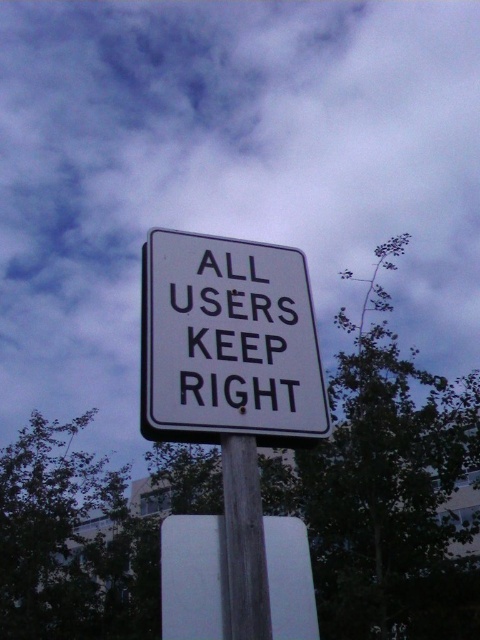
Question: Is white matte sign at center positioned in front of wooden post at center?

Choices:
 (A) yes
 (B) no

Answer: (A)

Question: Is white matte sign at center wider than wooden post at center?

Choices:
 (A) yes
 (B) no

Answer: (A)

Question: Is blackmaterial/texturetext at center further to camera compared to wooden post at center?

Choices:
 (A) yes
 (B) no

Answer: (A)

Question: Estimate the real-world distances between objects in this image. Which object is farther from the wooden post at center?

Choices:
 (A) white matte sign at center
 (B) blackmaterial/texturetext at center

Answer: (B)

Question: Which is nearer to the wooden post at center?

Choices:
 (A) white matte sign at center
 (B) blackmaterial/texturetext at center

Answer: (A)

Question: Which point is farther from the camera taking this photo?

Choices:
 (A) (228, 248)
 (B) (253, 481)
 (C) (216, 614)

Answer: (A)